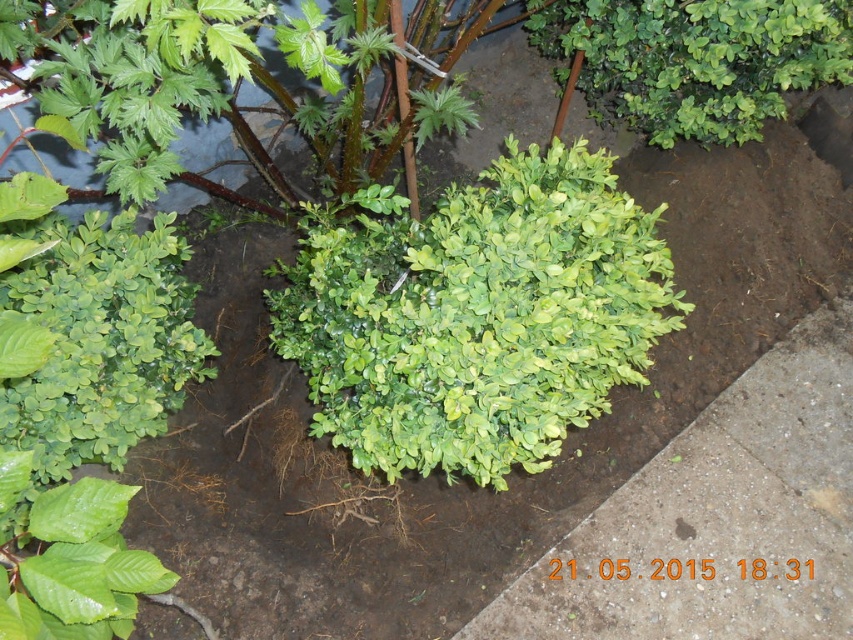
Question: Is green leafy shrub at center positioned at the back of green matte shrub at upper right?

Choices:
 (A) no
 (B) yes

Answer: (A)

Question: Can you confirm if green leafy shrub at center is positioned to the right of green matte shrub at upper right?

Choices:
 (A) yes
 (B) no

Answer: (B)

Question: Which object appears closest to the camera in this image?

Choices:
 (A) green leafy shrub at center
 (B) green matte shrub at upper right

Answer: (A)

Question: From the image, what is the correct spatial relationship of green leafy shrub at center in relation to green matte shrub at upper right?

Choices:
 (A) left
 (B) right

Answer: (A)